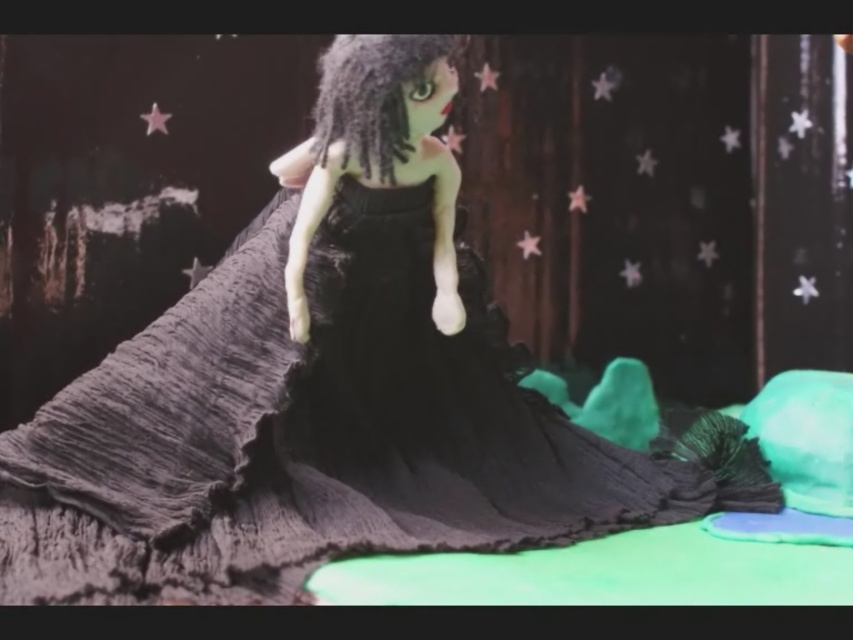
Is black crinkled fabric dress at center to the left of satin black hair at center from the viewer's perspective?

No, black crinkled fabric dress at center is not to the left of satin black hair at center.

Which is more to the right, black crinkled fabric dress at center or satin black hair at center?

Positioned to the right is black crinkled fabric dress at center.

I want to click on black crinkled fabric dress at center, so click(321, 433).

At what (x,y) coordinates should I click in order to perform the action: click on black crinkled fabric dress at center. Please return your answer as a coordinate pair (x, y). The height and width of the screenshot is (640, 853). Looking at the image, I should click on (321, 433).

Which of these two, matte black dress at center or satin black hair at center, stands taller?

matte black dress at center is taller.

How distant is matte black dress at center from satin black hair at center?

17.60 centimeters

The width and height of the screenshot is (853, 640). In order to click on matte black dress at center in this screenshot , I will do [x=427, y=356].

This screenshot has height=640, width=853. I want to click on matte black dress at center, so click(x=427, y=356).

Who is positioned more to the right, black crinkled fabric dress at center or matte black dress at center?

matte black dress at center

The image size is (853, 640). What do you see at coordinates (321, 433) in the screenshot?
I see `black crinkled fabric dress at center` at bounding box center [321, 433].

Does point (669, 470) come in front of point (396, 465)?

No.

Locate an element on the screen. black crinkled fabric dress at center is located at coordinates (321, 433).